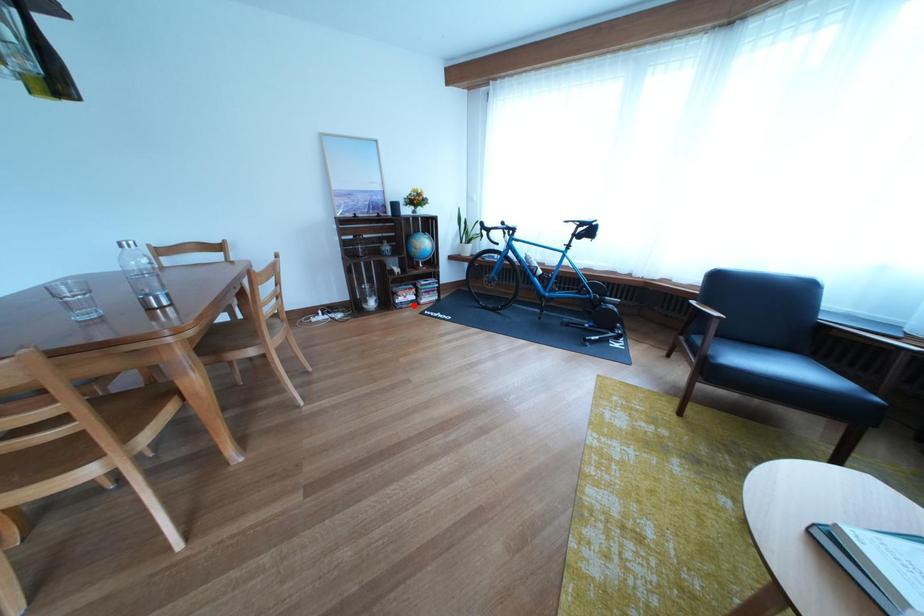
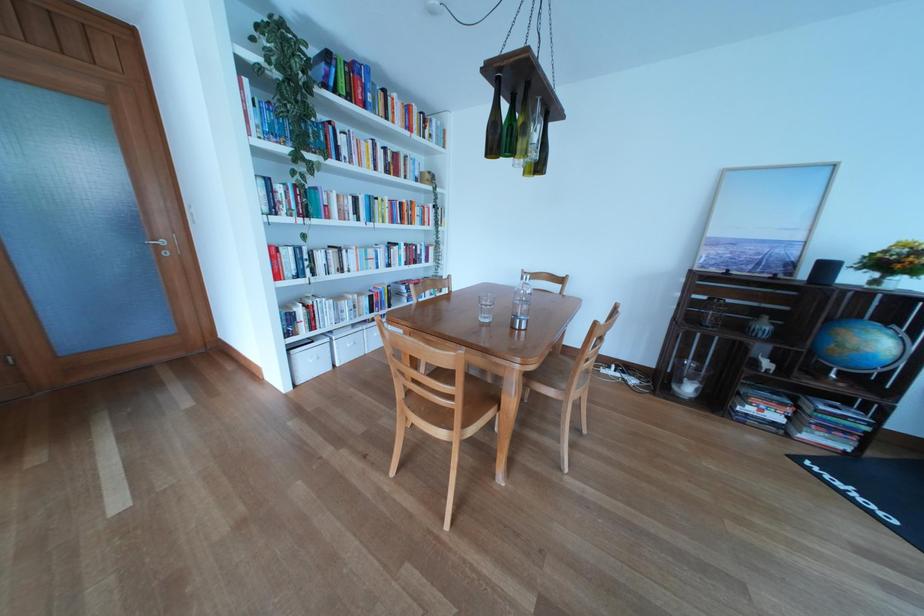
Question: A red point is marked in image1. In image2, is the corresponding 3D point closer to the camera or farther? Reply with the corresponding letter.

Choices:
 (A) The corresponding 3D point is closer.
 (B) The corresponding 3D point is farther.

Answer: (B)